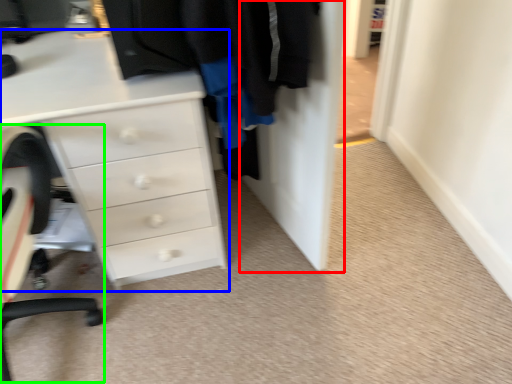
Question: Which is farther away from door (highlighted by a red box)? chest of drawers (highlighted by a blue box) or computer chair (highlighted by a green box)?

Choices:
 (A) chest of drawers
 (B) computer chair

Answer: (B)